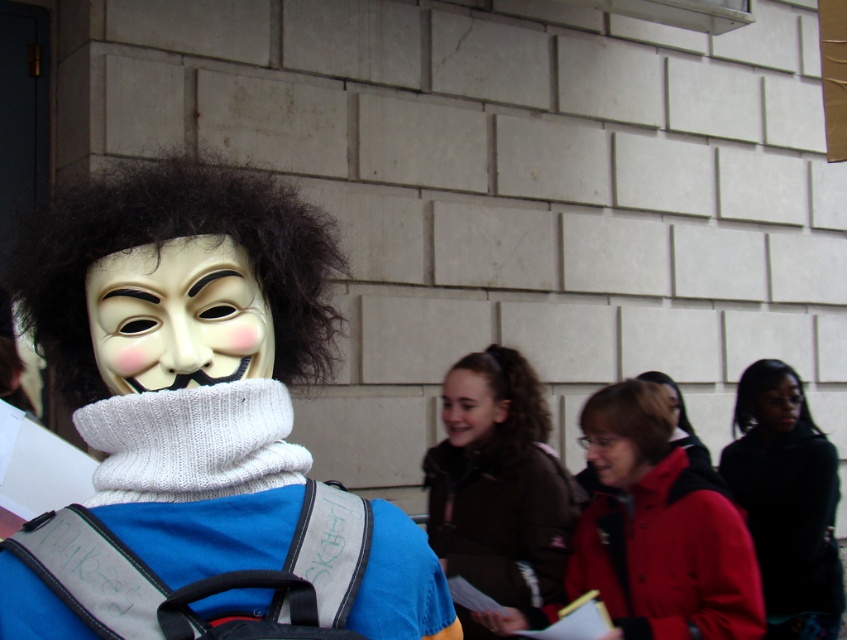
Question: Observing the image, what is the correct spatial positioning of black matte jacket at lower right in reference to matte red jacket at center?

Choices:
 (A) below
 (B) above

Answer: (A)

Question: Which of these objects is positioned closest to the matte black jacket at center?

Choices:
 (A) matte black mask at center
 (B) smooth skin face at center

Answer: (A)

Question: Is dark brown jacket at center below brown curly hair at lower center?

Choices:
 (A) yes
 (B) no

Answer: (A)

Question: Which object is closer to the camera taking this photo?

Choices:
 (A) matte black jacket at center
 (B) black silky hair at center

Answer: (A)

Question: Which of these objects is positioned closest to the dark brown jacket at center?

Choices:
 (A) white matte mask at center
 (B) red jacket at center
 (C) matte red jacket at center

Answer: (B)

Question: Is black matte jacket at lower right to the right of matte plastic mask at center from the viewer's perspective?

Choices:
 (A) yes
 (B) no

Answer: (A)